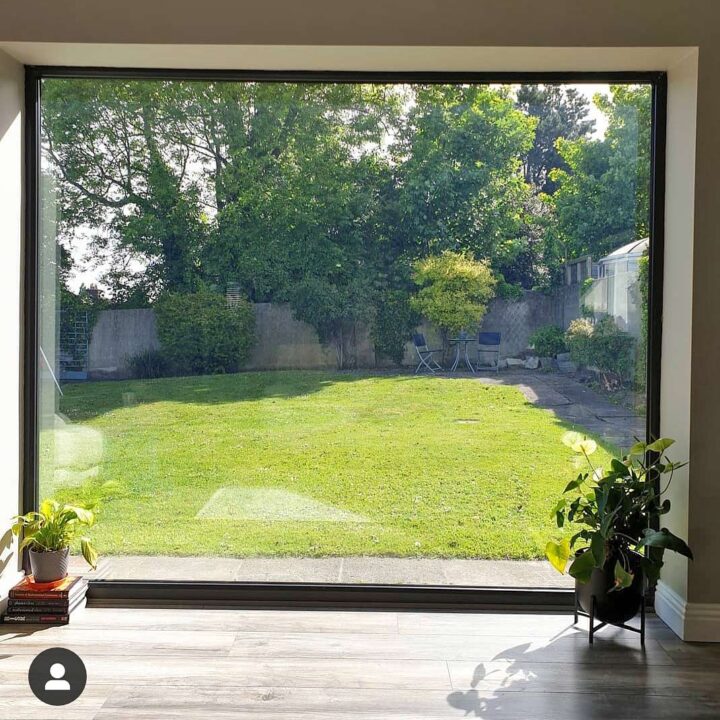
Where is `wall`? wall is located at coordinates pyautogui.click(x=402, y=11).